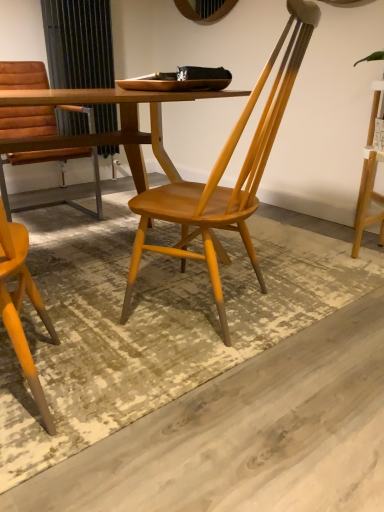
Question: Does wooden table at center come in front of matte brown leather chair at left, acting as the 1th chair starting from the back?

Choices:
 (A) yes
 (B) no

Answer: (A)

Question: Considering the relative positions of wooden table at center and matte brown leather chair at left, which is the 1th chair from left to right, in the image provided, is wooden table at center to the right of matte brown leather chair at left, which is the 1th chair from left to right, from the viewer's perspective?

Choices:
 (A) no
 (B) yes

Answer: (B)

Question: Can you confirm if wooden table at center is thinner than matte brown leather chair at left, the 2th chair in the front-to-back sequence?

Choices:
 (A) yes
 (B) no

Answer: (B)

Question: From the image's perspective, would you say wooden table at center is positioned over matte brown leather chair at left, acting as the 2th chair starting from the right?

Choices:
 (A) no
 (B) yes

Answer: (A)

Question: From a real-world perspective, is wooden table at center over matte brown leather chair at left, acting as the 2th chair starting from the right?

Choices:
 (A) yes
 (B) no

Answer: (B)

Question: Can you confirm if wooden table at center is wider than matte brown leather chair at left, which is the 1th chair from left to right?

Choices:
 (A) no
 (B) yes

Answer: (B)

Question: Does matte brown leather chair at left, which is the 1th chair from left to right, have a greater width compared to wooden table at center?

Choices:
 (A) yes
 (B) no

Answer: (B)

Question: Is matte brown leather chair at left, acting as the 1th chair starting from the back, taller than wooden table at center?

Choices:
 (A) yes
 (B) no

Answer: (A)

Question: From the image's perspective, would you say matte brown leather chair at left, acting as the 1th chair starting from the back, is shown under wooden table at center?

Choices:
 (A) no
 (B) yes

Answer: (A)

Question: From the image's perspective, is matte brown leather chair at left, acting as the 2th chair starting from the right, over wooden table at center?

Choices:
 (A) yes
 (B) no

Answer: (A)

Question: Does matte brown leather chair at left, which is the 1th chair from left to right, have a larger size compared to wooden table at center?

Choices:
 (A) no
 (B) yes

Answer: (A)

Question: Is the position of matte brown leather chair at left, acting as the 2th chair starting from the right, less distant than that of wooden table at center?

Choices:
 (A) yes
 (B) no

Answer: (B)

Question: Can you confirm if matte brown leather chair at left, the 2th chair in the front-to-back sequence, is bigger than wooden chair at center, placed as the 2th chair when sorted from left to right?

Choices:
 (A) yes
 (B) no

Answer: (A)